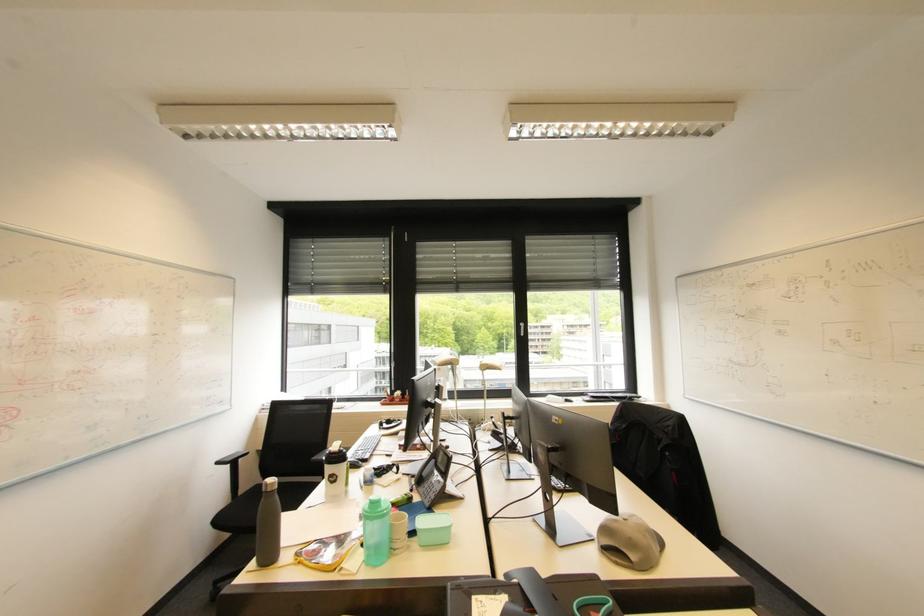
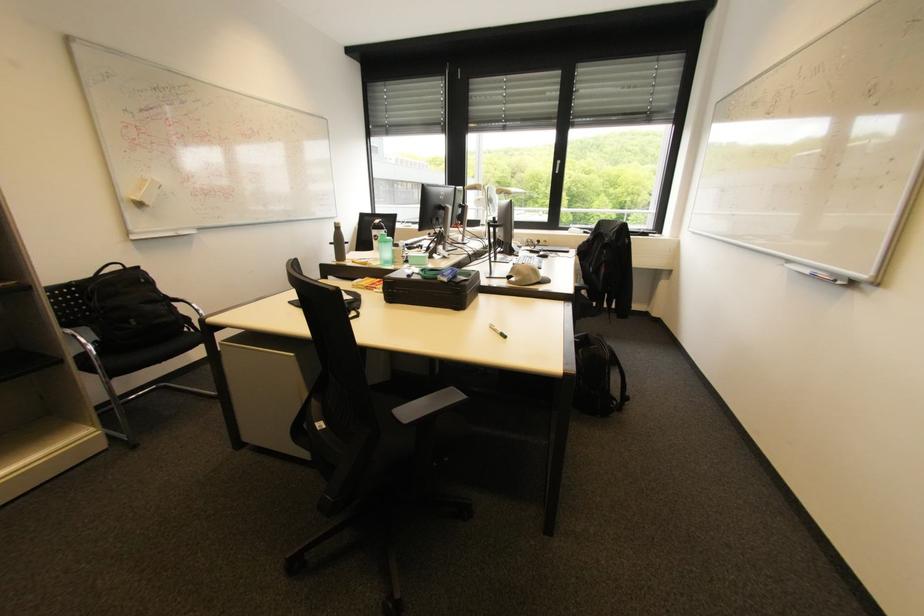
Where in the second image is the point corresponding to (339,483) from the first image?

(382, 240)